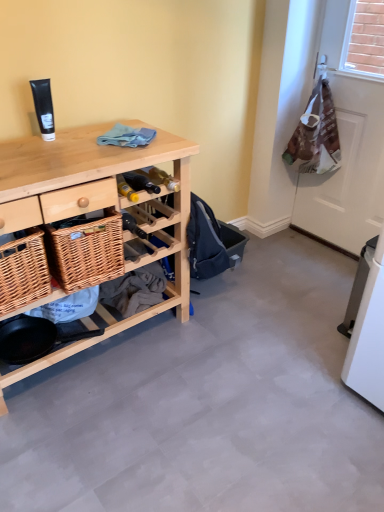
Where is `natural wood desk at left`? The height and width of the screenshot is (512, 384). natural wood desk at left is located at coordinates (96, 208).

The image size is (384, 512). Describe the element at coordinates (44, 108) in the screenshot. I see `black matte tube at upper left` at that location.

Locate an element on the screen. woven brown picnic basket at lower left is located at coordinates (23, 271).

The image size is (384, 512). Describe the element at coordinates (127, 136) in the screenshot. I see `blue cotton cloth at center` at that location.

The width and height of the screenshot is (384, 512). I want to click on blue cotton cloth at center, so click(x=127, y=136).

This screenshot has width=384, height=512. Describe the element at coordinates (347, 148) in the screenshot. I see `brown paper bag at right` at that location.

The image size is (384, 512). I want to click on natural wood desk at left, so click(96, 208).

Between black matte tube at upper left and blue cotton cloth at center, which one has smaller width?

black matte tube at upper left is thinner.

Is black matte tube at upper left positioned with its back to blue cotton cloth at center?

No.

From a real-world perspective, between black matte tube at upper left and blue cotton cloth at center, who is vertically lower?

blue cotton cloth at center is physically lower.

Does point (40, 125) come behind point (110, 141)?

Yes, point (40, 125) is behind point (110, 141).

From the image's perspective, which is below, woven brown picnic basket at lower left or black matte tube at upper left?

From the image's view, woven brown picnic basket at lower left is below.

Is the depth of woven brown picnic basket at lower left less than that of black matte tube at upper left?

Yes, the depth of woven brown picnic basket at lower left is less than that of black matte tube at upper left.

Is woven brown picnic basket at lower left located outside black matte tube at upper left?

woven brown picnic basket at lower left lies outside black matte tube at upper left's area.

Would you consider woven brown picnic basket at lower left to be distant from black matte tube at upper left?

Actually, woven brown picnic basket at lower left and black matte tube at upper left are a little close together.

Who is smaller, woven brown picnic basket at lower left or brown paper bag at right?

With smaller size is woven brown picnic basket at lower left.

Is woven brown picnic basket at lower left closer to the viewer compared to brown paper bag at right?

That is True.

Between woven brown picnic basket at lower left and brown paper bag at right, which one has more height?

Standing taller between the two is brown paper bag at right.

Does point (27, 258) lie behind point (340, 110)?

That is False.

Is black matte tube at upper left thinner than natural wood desk at left?

Yes.

Find the location of `desk below the black matte tube at upper left (from the image's perspective)`. desk below the black matte tube at upper left (from the image's perspective) is located at coordinates (96, 208).

Which is more distant, (44, 90) or (84, 144)?

Point (44, 90)

Find the location of a particular element. The width and height of the screenshot is (384, 512). screen door above the natural wood desk at left (from the image's perspective) is located at coordinates (347, 148).

Are brown paper bag at right and natural wood desk at left making contact?

No, brown paper bag at right is not beside natural wood desk at left.

From the image's perspective, is brown paper bag at right located beneath natural wood desk at left?

No, from the image's perspective, brown paper bag at right is not beneath natural wood desk at left.

Is woven brown picnic basket at lower left facing towards blue cotton cloth at center?

No.

From a real-world perspective, which is physically above, woven brown picnic basket at lower left or blue cotton cloth at center?

blue cotton cloth at center.

From the image's perspective, would you say woven brown picnic basket at lower left is shown under blue cotton cloth at center?

Yes.

Is woven brown picnic basket at lower left not close to blue cotton cloth at center?

They are positioned close to each other.

Can you confirm if brown paper bag at right is positioned to the right of blue cotton cloth at center?

Yes.

From a real-world perspective, which is physically below, brown paper bag at right or blue cotton cloth at center?

brown paper bag at right.

Between point (313, 201) and point (153, 132), which one is positioned behind?

The point (313, 201) is farther from the camera.

Is brown paper bag at right not close to blue cotton cloth at center?

brown paper bag at right is far away from blue cotton cloth at center.

The height and width of the screenshot is (512, 384). I want to click on toiletry lying on the left of blue cotton cloth at center, so click(44, 108).

The height and width of the screenshot is (512, 384). In order to click on picnic basket in front of the black matte tube at upper left in this screenshot , I will do `click(23, 271)`.

Considering their positions, is black matte tube at upper left positioned closer to brown paper bag at right than woven brown picnic basket at lower left?

black matte tube at upper left.

Which object lies further to the anchor point blue cotton cloth at center, black matte tube at upper left or brown paper bag at right?

brown paper bag at right is further to blue cotton cloth at center.

From the image, which object appears to be nearer to brown paper bag at right, blue cotton cloth at center or woven brown picnic basket at lower left?

Among the two, blue cotton cloth at center is located nearer to brown paper bag at right.

Consider the image. Estimate the real-world distances between objects in this image. Which object is closer to brown paper bag at right, black matte tube at upper left or blue cotton cloth at center?

blue cotton cloth at center lies closer to brown paper bag at right than the other object.

Estimate the real-world distances between objects in this image. Which object is closer to brown paper bag at right, blue cotton cloth at center or black matte tube at upper left?

blue cotton cloth at center is closer to brown paper bag at right.

From the image, which object appears to be nearer to black matte tube at upper left, natural wood desk at left or brown paper bag at right?

natural wood desk at left is positioned closer to the anchor black matte tube at upper left.

Which object lies nearer to the anchor point natural wood desk at left, woven brown picnic basket at lower left or black matte tube at upper left?

woven brown picnic basket at lower left.

Based on their spatial positions, is blue cotton cloth at center or brown paper bag at right closer to black matte tube at upper left?

The object closer to black matte tube at upper left is blue cotton cloth at center.

You are a GUI agent. You are given a task and a screenshot of the screen. Output one action in this format:
    pyautogui.click(x=<x>, y=<y>)
    Task: Click on the picnic basket between black matte tube at upper left and natural wood desk at left in the vertical direction
    This screenshot has height=512, width=384.
    Given the screenshot: What is the action you would take?
    pyautogui.click(x=23, y=271)

Locate an element on the screen. Image resolution: width=384 pixels, height=512 pixels. clothing between natural wood desk at left and brown paper bag at right from left to right is located at coordinates (127, 136).

Identify the location of clothing between black matte tube at upper left and natural wood desk at left vertically. (127, 136).

The height and width of the screenshot is (512, 384). I want to click on clothing between black matte tube at upper left and woven brown picnic basket at lower left in the vertical direction, so click(127, 136).